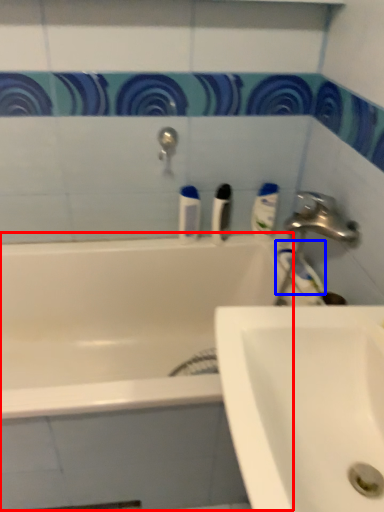
Question: Which object appears farthest to the camera in this image, bath (highlighted by a red box) or toothpaste (highlighted by a blue box)?

Choices:
 (A) bath
 (B) toothpaste

Answer: (B)